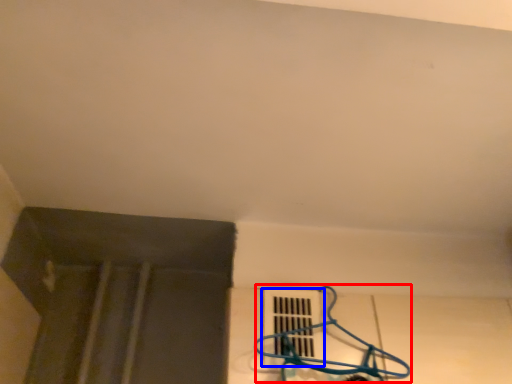
Question: Which object is closer to the camera taking this photo, hanger (highlighted by a red box) or window (highlighted by a blue box)?

Choices:
 (A) hanger
 (B) window

Answer: (A)